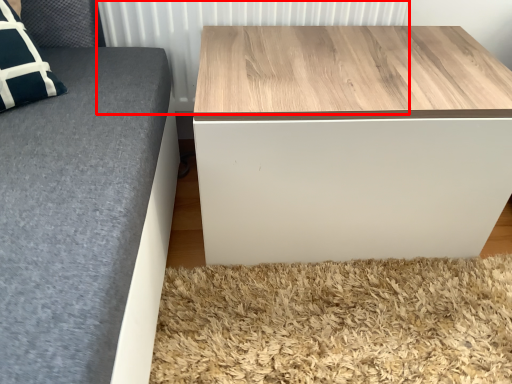
Question: Where is radiator (annotated by the red box) located in relation to table in the image?

Choices:
 (A) left
 (B) right

Answer: (A)